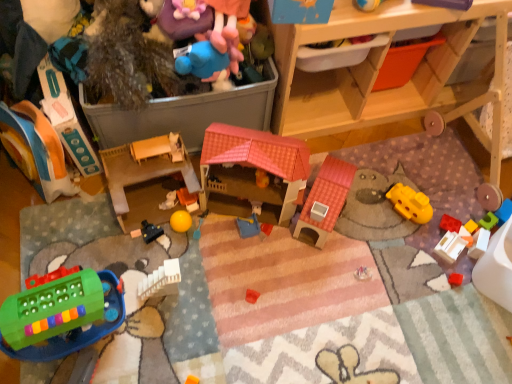
I want to click on free space between green plastic building block at lower left, positioned as the 11th toy in right-to-left order, and blue plastic toy at center, the ninth toy positioned from the left, so click(x=192, y=267).